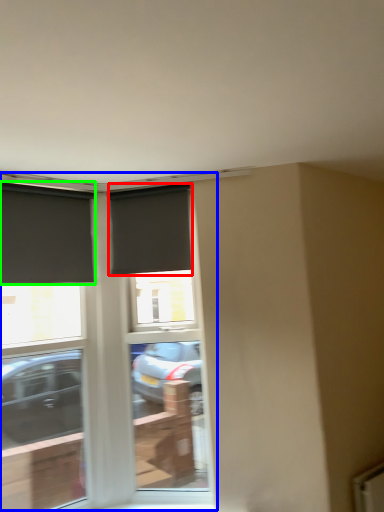
Question: Based on their relative distances, which object is farther from window (highlighted by a red box)? Choose from window (highlighted by a blue box) and window (highlighted by a green box).

Choices:
 (A) window
 (B) window

Answer: (A)